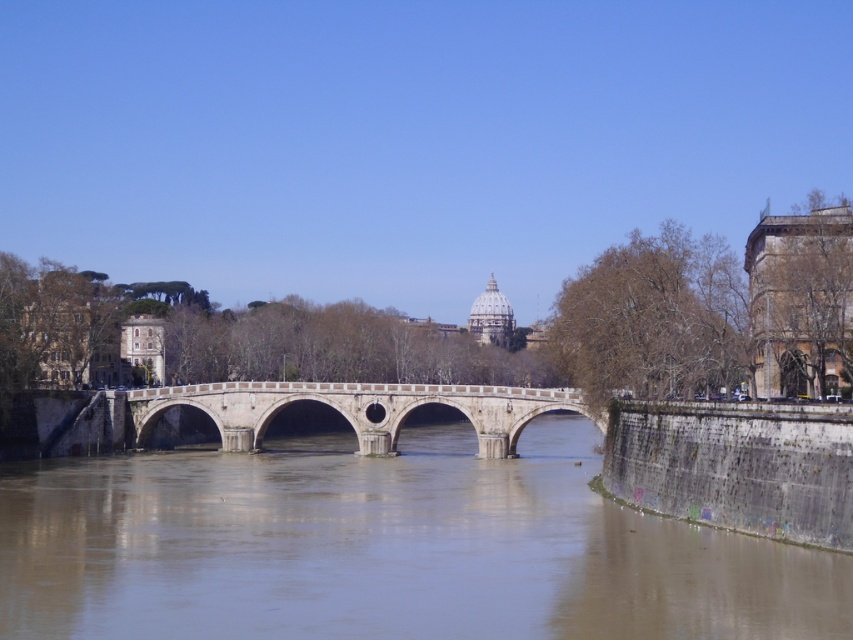
Question: Among these objects, which one is nearest to the camera?

Choices:
 (A) brown concrete river at center
 (B) white stone arch bridge at center

Answer: (A)

Question: Is brown concrete river at center closer to the viewer compared to white stone arch bridge at center?

Choices:
 (A) yes
 (B) no

Answer: (A)

Question: Can you confirm if brown concrete river at center is bigger than white stone arch bridge at center?

Choices:
 (A) yes
 (B) no

Answer: (A)

Question: Does brown concrete river at center lie in front of white stone arch bridge at center?

Choices:
 (A) no
 (B) yes

Answer: (B)